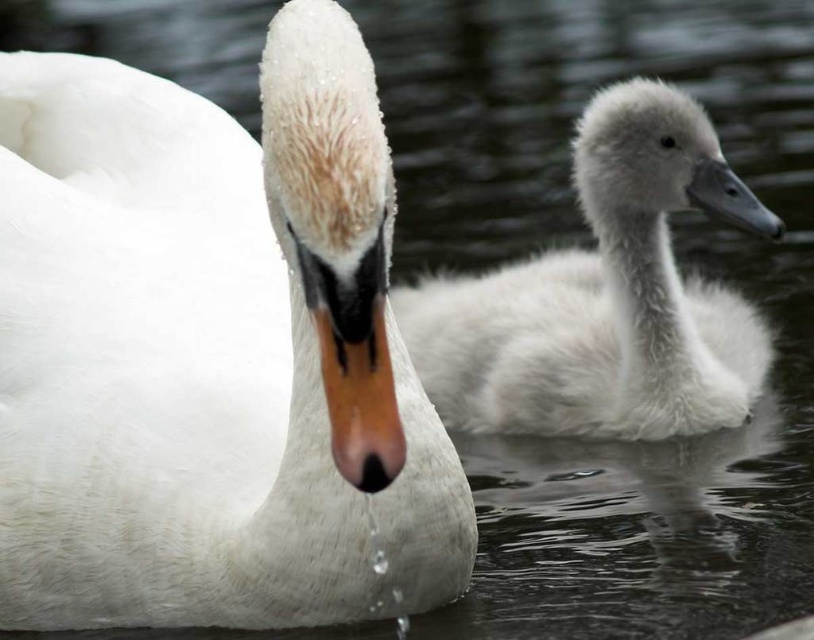
You are standing at the edge of the pond and see two points in the water. The first point is at coordinates point (x=151, y=481) and the second point is at point (x=646, y=93). Which point is closer to you?

Point (x=151, y=481) is closer to the viewer than point (x=646, y=93).

You are standing at the edge of the pond and want to take a photo of the swans. The camera you have can only focus on objects within 2 meters. Is the point at coordinates point (195, 410) within the camera focus range?

The distance of point (195, 410) from camera is 2.22 meters, which is beyond the camera focus range of 2 meters. Therefore, the point is out of focus.